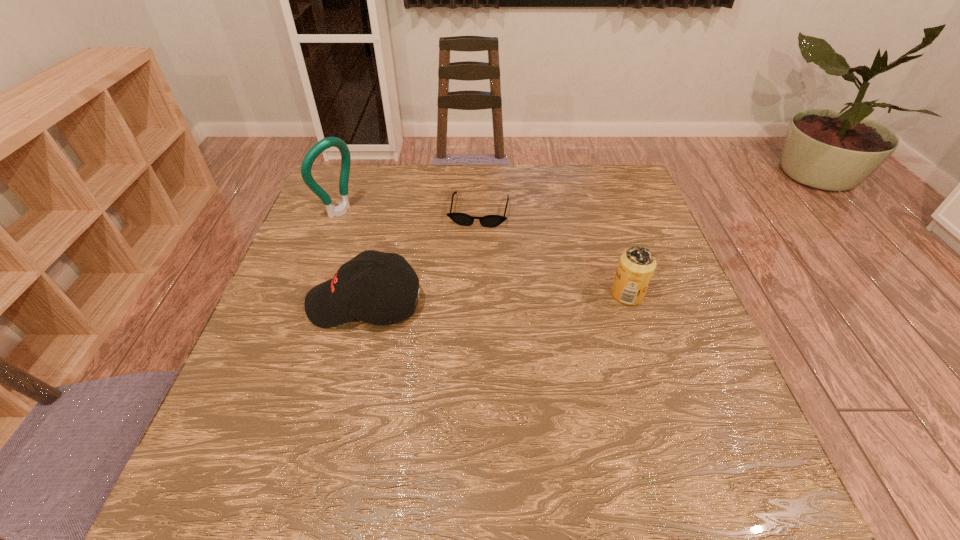
Locate an element on the screen. free space that satisfies the following two spatial constraints: 1. on the front side of the baseball cap; 2. on the front-facing side of the tallest object is located at coordinates (305, 303).